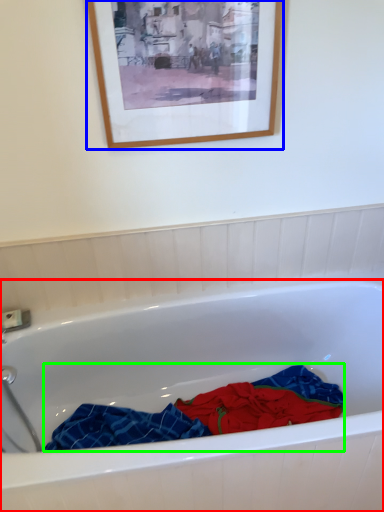
Question: Which object is the closest to the bathtub (highlighted by a red box)? Choose among these: picture frame (highlighted by a blue box) or material (highlighted by a green box).

Choices:
 (A) picture frame
 (B) material

Answer: (B)